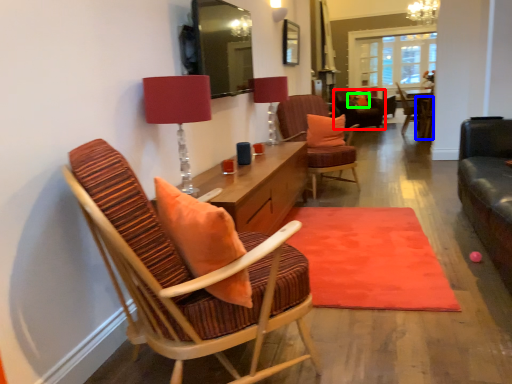
Question: Which object is positioned farthest from chair (highlighted by a red box)? Select from chair (highlighted by a blue box) and pillow (highlighted by a green box).

Choices:
 (A) chair
 (B) pillow

Answer: (A)